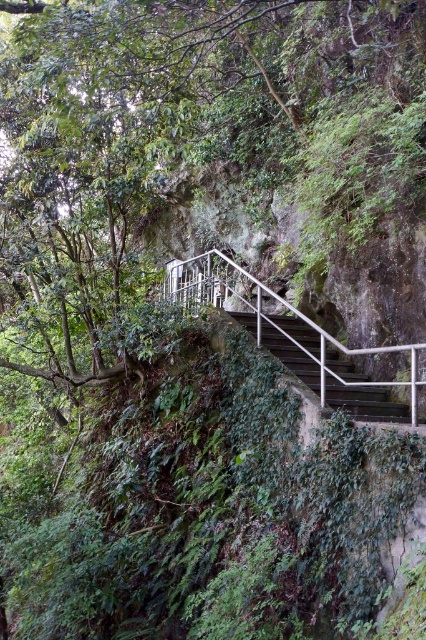
You are a hiker trying to determine the best path up the cliff. You notice a green leafy tree at upper left and metallic gray stairs at center. Which object is shorter in height?

The green leafy tree at upper left is not as tall as metallic gray stairs at center, so the green leafy tree at upper left is shorter in height.

You are standing at the base of the stairs and want to reach the top. You notice two points marked on the image, point 1 at coordinates point (322, 234) and point 2 at coordinates point (399, 385). Which point is closer to you as you stand at the base?

Point (322, 234) is closer to you because it is further to the camera than point (399, 385), meaning it is physically nearer to your position at the base of the stairs.

You are a painter who needs to assess the visibility of the metallic gray stairs at center from a distance. Considering the presence of the metallic silver balustrade at center, which is larger in size, would the stairs be more or less visible?

The metallic silver balustrade at center has a larger size compared to metallic gray stairs at center, so the stairs would be less visible due to the balustrade obstructing the view.